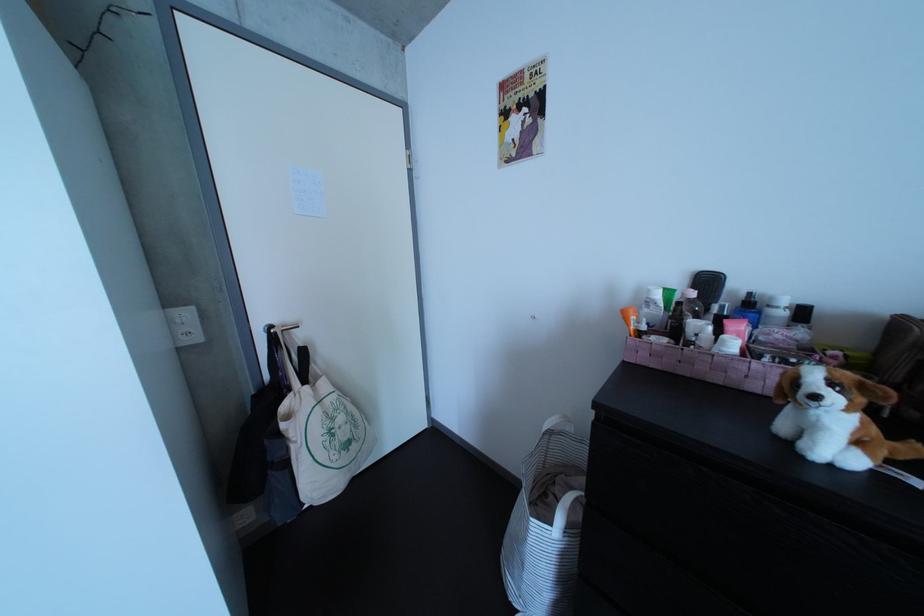
Where is `white tote bag`? This screenshot has height=616, width=924. white tote bag is located at coordinates (321, 432).